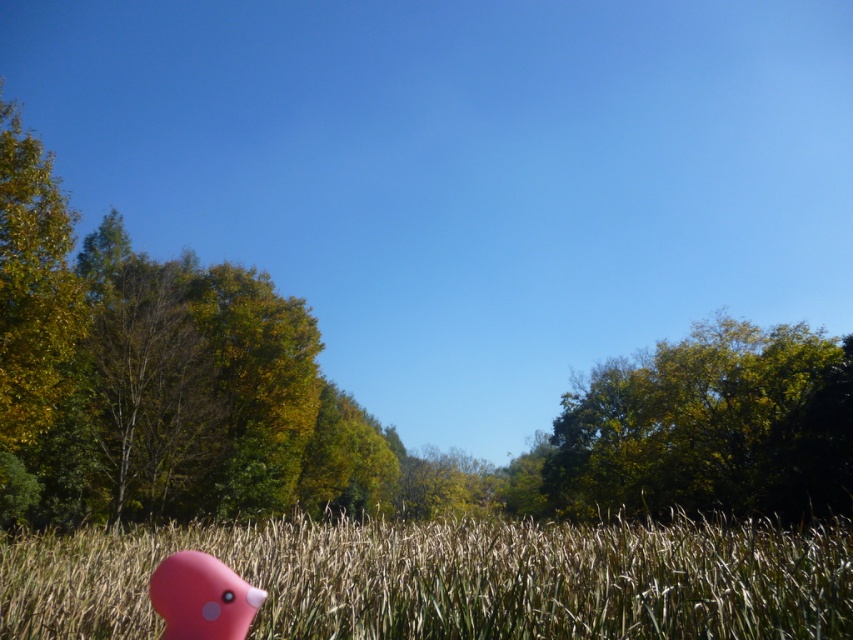
Question: Does grassy field at lower center lie behind pink rubber duck at lower left?

Choices:
 (A) yes
 (B) no

Answer: (A)

Question: Based on their relative distances, which object is nearer to the pink rubber duck at lower left?

Choices:
 (A) grassy field at lower center
 (B) green leafy tree at upper right

Answer: (A)

Question: Which of the following is the closest to the observer?

Choices:
 (A) green leafy tree at upper right
 (B) grassy field at lower center
 (C) pink rubber duck at lower left

Answer: (C)

Question: Does grassy field at lower center lie in front of green leafy tree at upper right?

Choices:
 (A) yes
 (B) no

Answer: (A)

Question: Which point is closer to the camera?

Choices:
 (A) (572, 404)
 (B) (521, 579)

Answer: (B)

Question: Is green leafy tree at upper right closer to the viewer compared to pink rubber duck at lower left?

Choices:
 (A) yes
 (B) no

Answer: (B)